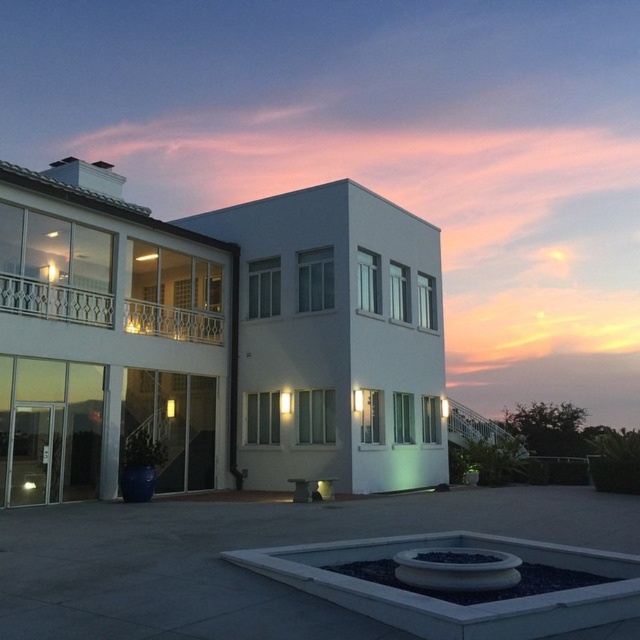
Which is in front, point (97, 291) or point (26, 416)?

Point (26, 416) is more forward.

The height and width of the screenshot is (640, 640). What do you see at coordinates (54, 301) in the screenshot? I see `white wrought iron balcony at upper left` at bounding box center [54, 301].

Where is `white wrought iron balcony at upper left`? This screenshot has height=640, width=640. white wrought iron balcony at upper left is located at coordinates (54, 301).

Does white smooth villa at center appear over white wrought iron balcony at upper left?

Actually, white smooth villa at center is below white wrought iron balcony at upper left.

Between point (280, 419) and point (192, 324), which one is positioned behind?

The point (192, 324) is more distant.

Image resolution: width=640 pixels, height=640 pixels. I want to click on white smooth villa at center, so click(x=221, y=336).

Is point (24, 170) more distant than point (10, 499)?

Yes, it is.

Is point (113, 360) closer to camera compared to point (24, 486)?

No, (113, 360) is behind (24, 486).

Locate an element on the screen. The height and width of the screenshot is (640, 640). white smooth villa at center is located at coordinates (221, 336).